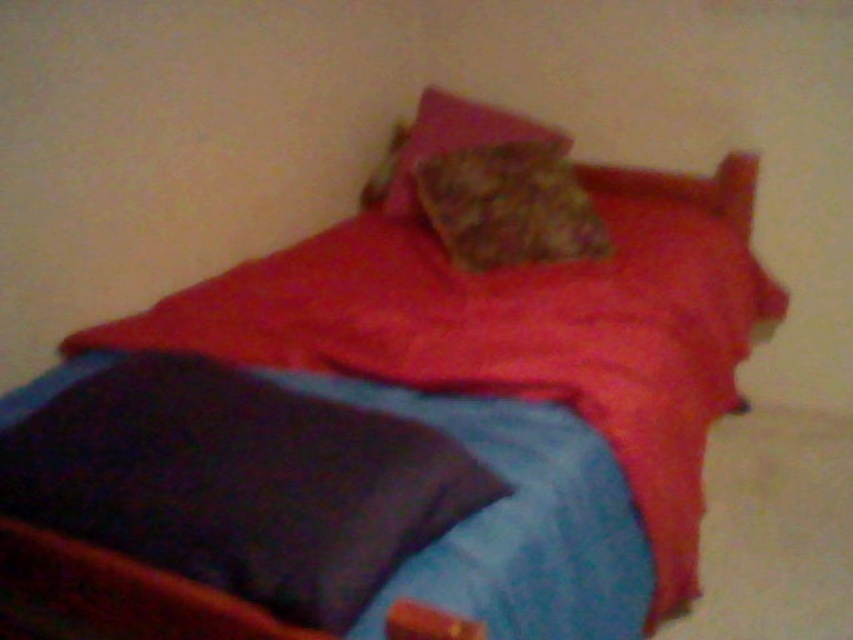
Is point (461, 554) positioned in front of point (397, 198)?

Yes, it is in front of point (397, 198).

Is point (432, 589) more distant than point (523, 120)?

No, it is not.

At what (x,y) coordinates should I click in order to perform the action: click on blue fabric sheet at lower left. Please return your answer as a coordinate pair (x, y). Looking at the image, I should click on (519, 522).

Consider the image. Who is shorter, blue fabric sheet at lower left or fluffy brown pillow at center?

Standing shorter between the two is fluffy brown pillow at center.

In the scene shown: Can you confirm if blue fabric sheet at lower left is positioned below fluffy brown pillow at center?

Indeed, blue fabric sheet at lower left is positioned under fluffy brown pillow at center.

Is point (570, 627) positioned after point (570, 170)?

No, (570, 627) is closer to viewer.

Identify the location of blue fabric sheet at lower left. The height and width of the screenshot is (640, 853). (519, 522).

Is fluffy brown pillow at center positioned behind fluffy pink pillow at upper center?

No, it is not.

Can you confirm if fluffy brown pillow at center is positioned above fluffy pink pillow at upper center?

No, fluffy brown pillow at center is not above fluffy pink pillow at upper center.

Who is more forward, [581,244] or [474,109]?

Point [581,244]

Identify the location of fluffy brown pillow at center. This screenshot has height=640, width=853. (508, 205).